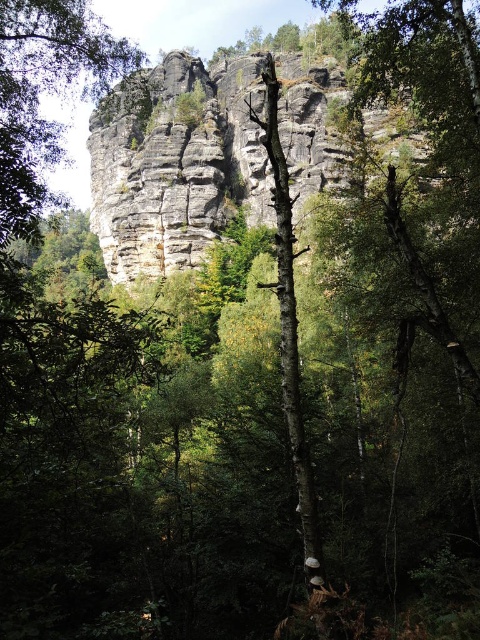
You are a hiker planning to take a photo of the gray rock formation at center and the rough textured rock at upper center. Which rock has a greater width?

The gray rock formation at center has a greater width than the rough textured rock at upper center.

You are a hiker planning to climb both the gray rock formation at center and the rough textured rock at upper center. Given that the distance between them is 211.07 feet, can you estimate how long it would take to walk between them at a leisurely pace of 3 feet per minute?

The distance between the gray rock formation at center and the rough textured rock at upper center is 211.07 feet. At a leisurely pace of 3 feet per minute, it would take approximately 70.36 minutes to walk between them.

Looking at this image, you are standing at the point marked as point (144, 180) in the image, which is 133.98 meters away from the camera. If you want to take a photo of the towering rock formation, which is the main subject of the image, should you move closer or stay where you are?

You should move closer to the point (144, 180) because it is currently 133.98 meters away from the camera, which might be too far to capture the towering rock formation clearly. Moving closer would allow for a better composition and detail capture of the rock formation.